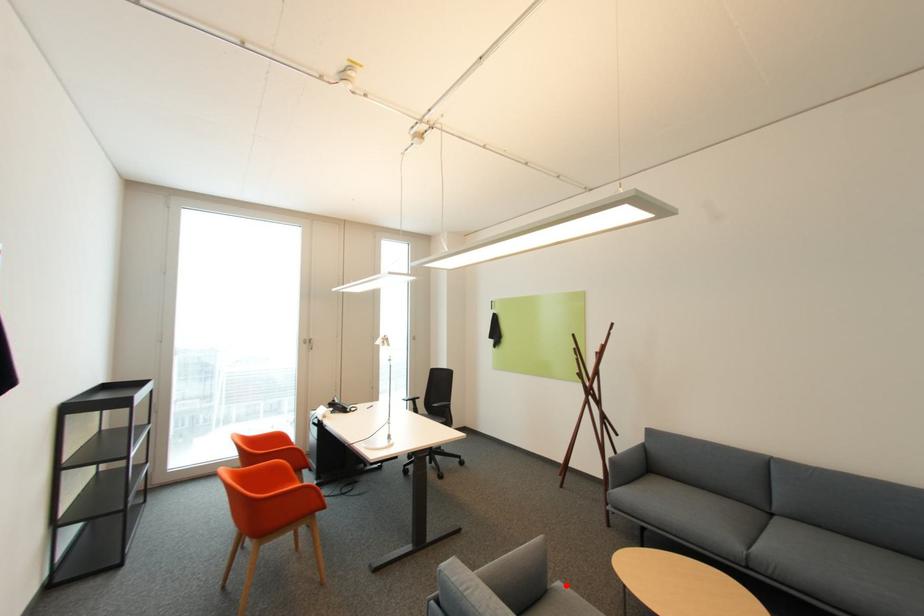
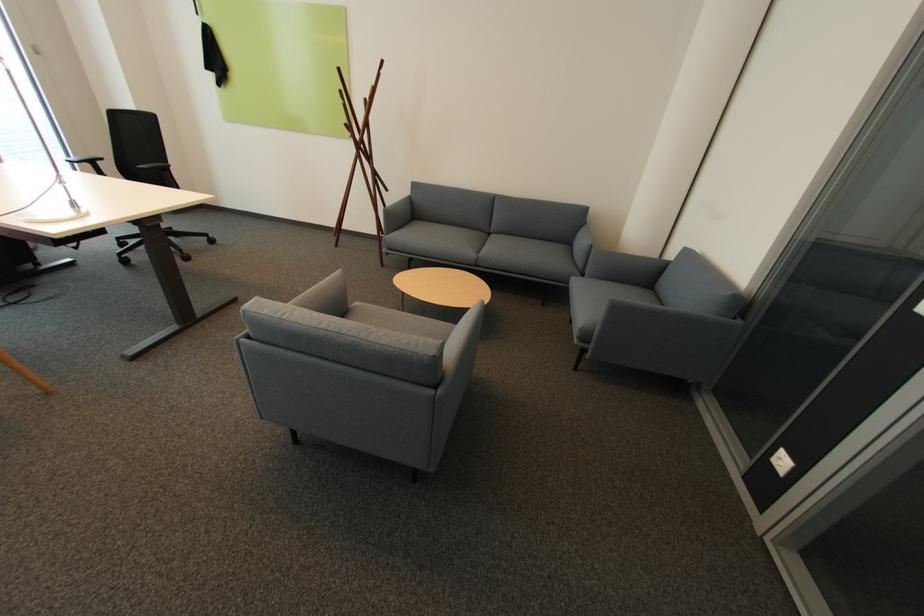
Question: I am providing you with two images of the same scene from different viewpoints. Image1 has a red point marked. In image2, the corresponding 3D location appears at what relative position? Reply with the corresponding letter.

Choices:
 (A) Closer
 (B) Farther

Answer: (A)